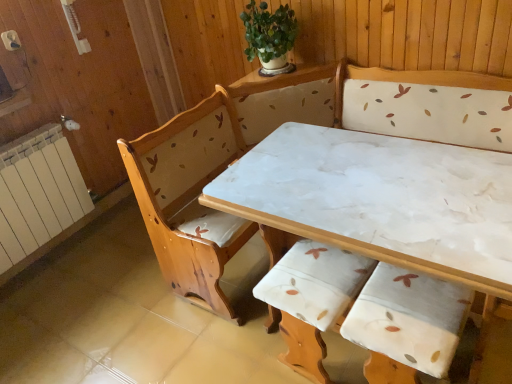
Question: From a real-world perspective, is wooden armchair with floral upholstery at center under white painted radiator at left?

Choices:
 (A) yes
 (B) no

Answer: (A)

Question: Is wooden armchair with floral upholstery at center facing away from white painted radiator at left?

Choices:
 (A) no
 (B) yes

Answer: (A)

Question: Can you confirm if wooden armchair with floral upholstery at center is bigger than white painted radiator at left?

Choices:
 (A) no
 (B) yes

Answer: (A)

Question: From the image's perspective, is wooden armchair with floral upholstery at center under white painted radiator at left?

Choices:
 (A) yes
 (B) no

Answer: (A)

Question: Is wooden armchair with floral upholstery at center at the right side of white painted radiator at left?

Choices:
 (A) no
 (B) yes

Answer: (B)

Question: From a real-world perspective, is wooden armchair with floral upholstery at center over white painted radiator at left?

Choices:
 (A) no
 (B) yes

Answer: (A)

Question: Is white painted radiator at left positioned far away from white marble table at center?

Choices:
 (A) no
 (B) yes

Answer: (B)

Question: Could you tell me if white painted radiator at left is facing white marble table at center?

Choices:
 (A) yes
 (B) no

Answer: (A)

Question: Are white painted radiator at left and white marble table at center making contact?

Choices:
 (A) yes
 (B) no

Answer: (B)

Question: Can you confirm if white painted radiator at left is positioned to the right of white marble table at center?

Choices:
 (A) yes
 (B) no

Answer: (B)

Question: Is white painted radiator at left taller than white marble table at center?

Choices:
 (A) no
 (B) yes

Answer: (A)

Question: Can you confirm if white painted radiator at left is thinner than white marble table at center?

Choices:
 (A) yes
 (B) no

Answer: (A)

Question: Does white marble table at center have a greater height compared to green leafy plant at upper center?

Choices:
 (A) no
 (B) yes

Answer: (B)